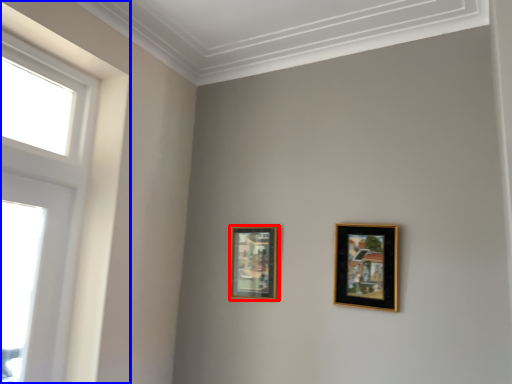
Question: Which object is closer to the camera taking this photo, picture frame (highlighted by a red box) or window (highlighted by a blue box)?

Choices:
 (A) picture frame
 (B) window

Answer: (B)